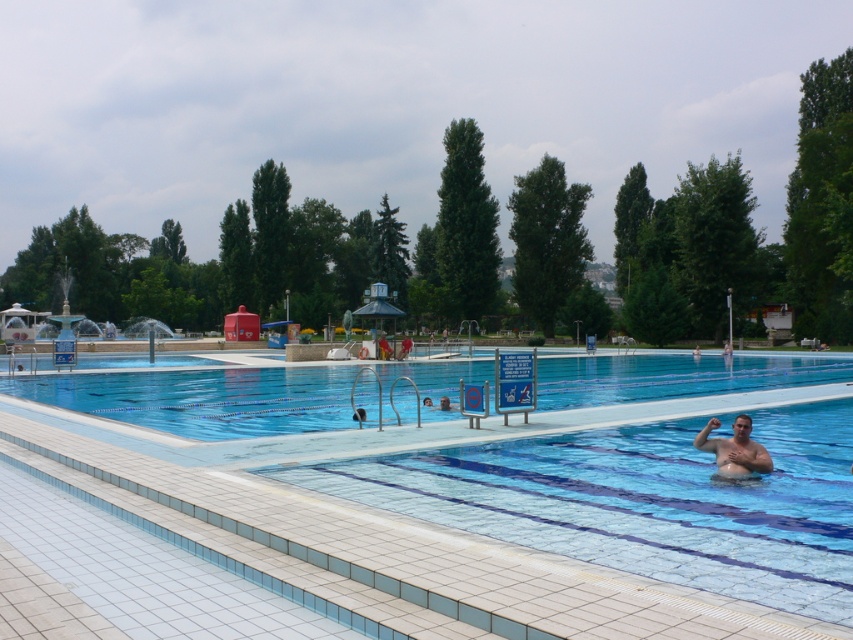
Which is behind, point (660, 394) or point (79, 388)?

Positioned behind is point (79, 388).

Is clear blue tiles at center wider than transparent glass pool at center?

Incorrect, clear blue tiles at center's width does not surpass transparent glass pool at center's.

Does point (466, 595) come farther from viewer compared to point (67, 401)?

No, (466, 595) is in front of (67, 401).

The image size is (853, 640). In order to click on clear blue tiles at center in this screenshot , I will do `click(431, 508)`.

Is transparent glass pool at center positioned at the back of skinny man at center?

Yes, transparent glass pool at center is further from the viewer.

Does transparent glass pool at center have a greater width compared to skinny man at center?

Correct, the width of transparent glass pool at center exceeds that of skinny man at center.

Where is `transparent glass pool at center`? transparent glass pool at center is located at coordinates (204, 397).

Does point (689, 461) come in front of point (734, 474)?

That is False.

This screenshot has width=853, height=640. I want to click on clear blue tiles at center, so click(x=431, y=508).